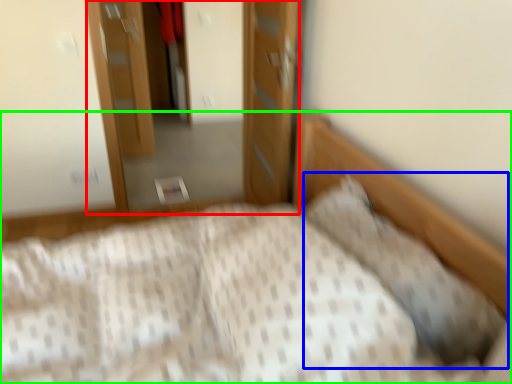
Question: Which object is the closest to the dresser (highlighted by a red box)? Choose among these: pillow (highlighted by a blue box) or bed (highlighted by a green box).

Choices:
 (A) pillow
 (B) bed

Answer: (B)